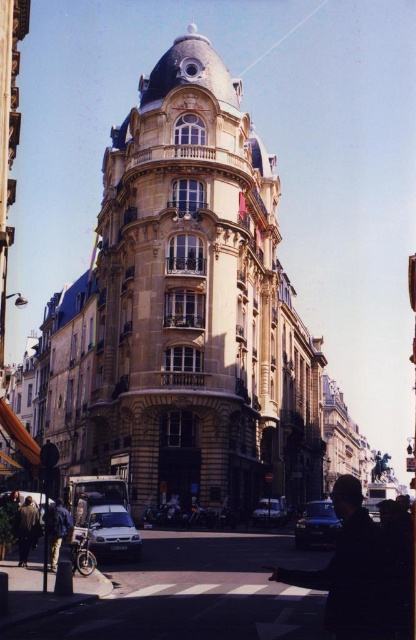
Question: Is shiny black car at center closer to the viewer compared to denim jacket at lower left?

Choices:
 (A) yes
 (B) no

Answer: (B)

Question: Estimate the real-world distances between objects in this image. Which object is farther from the shiny black car at center?

Choices:
 (A) dark matte figure at lower right
 (B) dark brown leather jacket at lower left
 (C) denim jacket at lower left

Answer: (B)

Question: Which point is farther to the camera?

Choices:
 (A) (34, 506)
 (B) (78, 529)
 (C) (267, 508)
 (D) (361, 561)

Answer: (C)

Question: Does silver metallic car at lower left have a larger size compared to dark brown leather jacket at lower left?

Choices:
 (A) no
 (B) yes

Answer: (A)

Question: Is silver metallic car at lower left thinner than denim jacket at lower left?

Choices:
 (A) no
 (B) yes

Answer: (B)

Question: Which object appears farthest from the camera in this image?

Choices:
 (A) shiny black car at center
 (B) metallic silver car at center
 (C) dark brown leather jacket at lower left

Answer: (B)